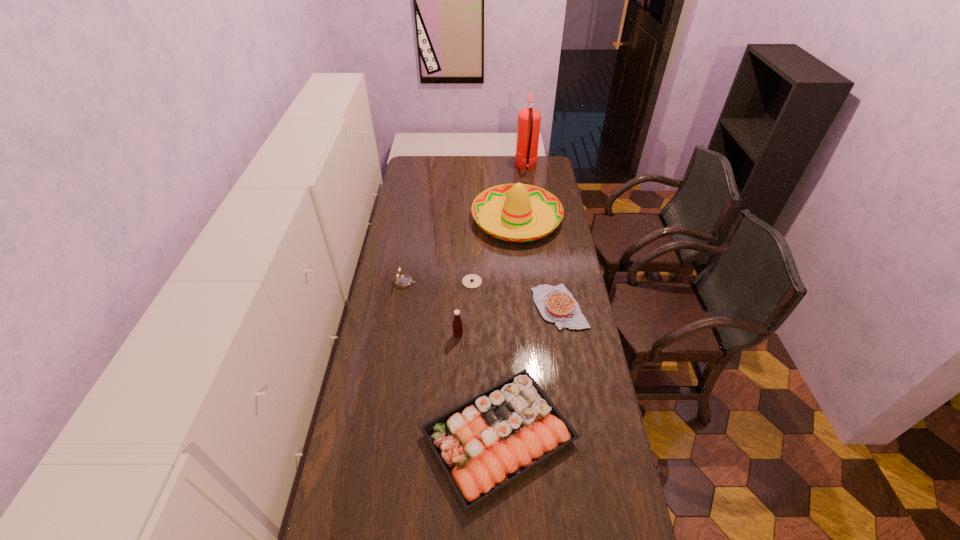
In the image, there is a desktop. In order to click on blank space at the far left corner in this screenshot , I will do `click(422, 160)`.

The image size is (960, 540). Find the location of `vacant space at the far right corner`. vacant space at the far right corner is located at coordinates (541, 176).

Locate an element on the screen. Image resolution: width=960 pixels, height=540 pixels. vacant area between the fifth shortest object and the right compass is located at coordinates (465, 308).

This screenshot has width=960, height=540. I want to click on empty space between the Tabasco sauce and the sombrero, so click(488, 276).

The width and height of the screenshot is (960, 540). I want to click on free spot between the sombrero and the taller compass, so click(461, 251).

Identify the location of unoccupied area between the sixth nearest object and the pie. (538, 262).

At what (x,y) coordinates should I click in order to perform the action: click on vacant space that is in between the pie and the taller compass. Please return your answer as a coordinate pair (x, y). The image size is (960, 540). Looking at the image, I should click on (482, 295).

Identify which object is located as the fifth nearest to the sixth nearest object. Please provide its 2D coordinates. Your answer should be formatted as a tuple, i.e. [(x, y)], where the tuple contains the x and y coordinates of a point satisfying the conditions above.

[(457, 324)]

Where is `object that is the nearest to the right compass`? The width and height of the screenshot is (960, 540). object that is the nearest to the right compass is located at coordinates (519, 202).

Find the location of a particular element. Image resolution: width=960 pixels, height=540 pixels. compass that is the closest to the platter is located at coordinates (471, 281).